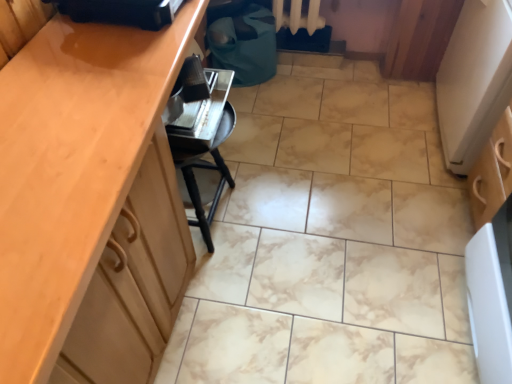
I want to click on free region under black plastic bag at upper center, acting as the second appliance starting from the back (from a real-world perspective), so click(x=146, y=20).